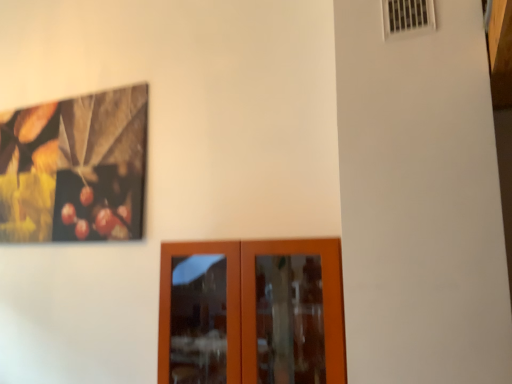
At what (x,y) coordinates should I click in order to perform the action: click on brown wooden door at lower center. Please return your answer as a coordinate pair (x, y). This screenshot has width=512, height=384. Looking at the image, I should click on (251, 312).

Describe the element at coordinates (251, 312) in the screenshot. The image size is (512, 384). I see `brown wooden door at lower center` at that location.

Where is `white plastic air conditioning at upper right`? Image resolution: width=512 pixels, height=384 pixels. white plastic air conditioning at upper right is located at coordinates pyautogui.click(x=407, y=18).

What do you see at coordinates (407, 18) in the screenshot?
I see `white plastic air conditioning at upper right` at bounding box center [407, 18].

You are a GUI agent. You are given a task and a screenshot of the screen. Output one action in this format:
    pyautogui.click(x=<x>, y=<y>)
    Task: Click on the brown wooden door at lower center
    
    Given the screenshot: What is the action you would take?
    pyautogui.click(x=251, y=312)

Considering the relative positions of white plastic air conditioning at upper right and brown wooden door at lower center in the image provided, is white plastic air conditioning at upper right to the left of brown wooden door at lower center from the viewer's perspective?

Incorrect, white plastic air conditioning at upper right is not on the left side of brown wooden door at lower center.

Which object is further away from the camera taking this photo, white plastic air conditioning at upper right or brown wooden door at lower center?

brown wooden door at lower center is further away from the camera.

Does point (433, 7) appear closer or farther from the camera than point (269, 381)?

Point (433, 7) is positioned closer to the camera compared to point (269, 381).

From the image's perspective, which one is positioned lower, white plastic air conditioning at upper right or brown wooden door at lower center?

From the image's view, brown wooden door at lower center is below.

From a real-world perspective, which object stands above the other?

white plastic air conditioning at upper right, from a real-world perspective.

Does white plastic air conditioning at upper right have a lesser width compared to brown wooden door at lower center?

Yes.

Is white plastic air conditioning at upper right shorter than brown wooden door at lower center?

Yes.

Does white plastic air conditioning at upper right have a larger size compared to brown wooden door at lower center?

Incorrect, white plastic air conditioning at upper right is not larger than brown wooden door at lower center.

Is brown wooden door at lower center completely or partially inside white plastic air conditioning at upper right?

No, brown wooden door at lower center is located outside of white plastic air conditioning at upper right.

Are white plastic air conditioning at upper right and brown wooden door at lower center making contact?

No, white plastic air conditioning at upper right is not touching brown wooden door at lower center.

Could you tell me if white plastic air conditioning at upper right is turned towards brown wooden door at lower center?

No, white plastic air conditioning at upper right is not facing towards brown wooden door at lower center.

How many degrees apart are the facing directions of white plastic air conditioning at upper right and brown wooden door at lower center?

0.00201 degrees.

Locate an element on the screen. door below the white plastic air conditioning at upper right (from the image's perspective) is located at coordinates (251, 312).

Can you confirm if brown wooden door at lower center is positioned to the right of white plastic air conditioning at upper right?

Incorrect, brown wooden door at lower center is not on the right side of white plastic air conditioning at upper right.

Which object is more forward, brown wooden door at lower center or white plastic air conditioning at upper right?

white plastic air conditioning at upper right is more forward.

Is point (292, 310) positioned behind point (384, 35)?

Yes, point (292, 310) is behind point (384, 35).

From the image's perspective, is brown wooden door at lower center located beneath white plastic air conditioning at upper right?

Yes.

From a real-world perspective, which object rests below the other?

brown wooden door at lower center.

Between brown wooden door at lower center and white plastic air conditioning at upper right, which one has smaller width?

white plastic air conditioning at upper right is thinner.

Considering the sizes of objects brown wooden door at lower center and white plastic air conditioning at upper right in the image provided, who is taller, brown wooden door at lower center or white plastic air conditioning at upper right?

brown wooden door at lower center is taller.

Does brown wooden door at lower center have a smaller size compared to white plastic air conditioning at upper right?

Incorrect, brown wooden door at lower center is not smaller in size than white plastic air conditioning at upper right.

Is brown wooden door at lower center not within white plastic air conditioning at upper right?

Absolutely, brown wooden door at lower center is external to white plastic air conditioning at upper right.

Would you say brown wooden door at lower center is a long distance from white plastic air conditioning at upper right?

Yes, brown wooden door at lower center and white plastic air conditioning at upper right are quite far apart.

Is brown wooden door at lower center positioned with its back to white plastic air conditioning at upper right?

No.

Measure the distance from brown wooden door at lower center to white plastic air conditioning at upper right.

brown wooden door at lower center is 3.89 feet away from white plastic air conditioning at upper right.

The height and width of the screenshot is (384, 512). In the image, there is a white plastic air conditioning at upper right. Find the location of `door below it (from a real-world perspective)`. door below it (from a real-world perspective) is located at coordinates (251, 312).

Where is `air conditioning above the brown wooden door at lower center (from the image's perspective)`? Image resolution: width=512 pixels, height=384 pixels. air conditioning above the brown wooden door at lower center (from the image's perspective) is located at coordinates (407, 18).

Find the location of a particular element. The width and height of the screenshot is (512, 384). door to the left of white plastic air conditioning at upper right is located at coordinates (251, 312).